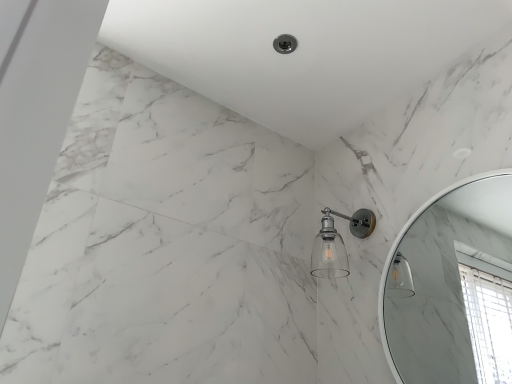
Question: Would you consider clear glass shower head at center to be distant from white glossy mirror at upper right?

Choices:
 (A) no
 (B) yes

Answer: (A)

Question: Is clear glass shower head at center turned away from white glossy mirror at upper right?

Choices:
 (A) no
 (B) yes

Answer: (A)

Question: From the image's perspective, is clear glass shower head at center on top of white glossy mirror at upper right?

Choices:
 (A) yes
 (B) no

Answer: (A)

Question: Can we say clear glass shower head at center lies outside white glossy mirror at upper right?

Choices:
 (A) yes
 (B) no

Answer: (A)

Question: Does clear glass shower head at center have a smaller size compared to white glossy mirror at upper right?

Choices:
 (A) yes
 (B) no

Answer: (A)

Question: From a real-world perspective, is clear glass shower head at center physically below white glossy mirror at upper right?

Choices:
 (A) no
 (B) yes

Answer: (A)

Question: Can you confirm if white glossy mirror at upper right is taller than clear glass shower head at center?

Choices:
 (A) yes
 (B) no

Answer: (A)

Question: From the image's perspective, is white glossy mirror at upper right below clear glass shower head at center?

Choices:
 (A) yes
 (B) no

Answer: (A)

Question: From a real-world perspective, is white glossy mirror at upper right on clear glass shower head at center?

Choices:
 (A) no
 (B) yes

Answer: (A)

Question: Does white glossy mirror at upper right have a smaller size compared to clear glass shower head at center?

Choices:
 (A) yes
 (B) no

Answer: (B)

Question: From a real-world perspective, is white glossy mirror at upper right physically below clear glass shower head at center?

Choices:
 (A) no
 (B) yes

Answer: (B)

Question: Is white glossy mirror at upper right thinner than clear glass shower head at center?

Choices:
 (A) yes
 (B) no

Answer: (A)

Question: Considering the positions of white glossy mirror at upper right and clear glass shower head at center in the image, is white glossy mirror at upper right taller or shorter than clear glass shower head at center?

Choices:
 (A) tall
 (B) short

Answer: (A)